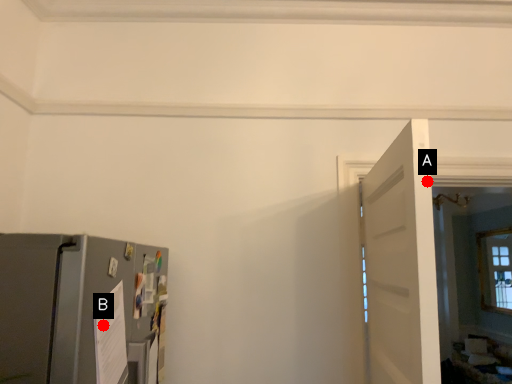
Question: Two points are circled on the image, labeled by A and B beside each circle. Which point is farther from the camera taking this photo?

Choices:
 (A) A is further
 (B) B is further

Answer: (A)